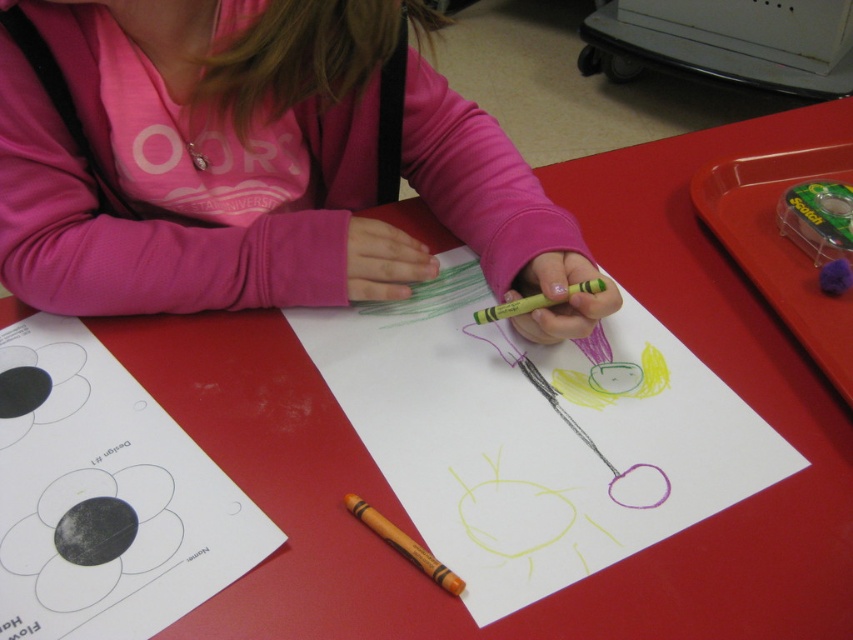
Based on the photo, which is below, colored paper at center or matte yellow crayon at center?

matte yellow crayon at center

Does point (769, 438) come farther from viewer compared to point (386, 538)?

Yes, point (769, 438) is farther from viewer.

Locate an element on the screen. This screenshot has height=640, width=853. colored paper at center is located at coordinates (535, 435).

Where is `colored paper at center`? The height and width of the screenshot is (640, 853). colored paper at center is located at coordinates (535, 435).

Which is more to the left, white paper at center or yellow matte crayon at center?

white paper at center is more to the left.

Looking at this image, which of these two, white paper at center or yellow matte crayon at center, stands taller?

white paper at center

Measure the distance between white paper at center and camera.

white paper at center and camera are 16.46 inches apart.

Where is `white paper at center`? The image size is (853, 640). white paper at center is located at coordinates point(105,497).

Is point (527, 378) farther from viewer compared to point (540, 300)?

Yes, point (527, 378) is farther from viewer.

Is point (550, 490) closer to camera compared to point (585, 288)?

Yes, point (550, 490) is in front of point (585, 288).

Who is more forward, (717, 428) or (577, 291)?

Point (577, 291)

Locate an element on the screen. This screenshot has height=640, width=853. colored paper at center is located at coordinates (535, 435).